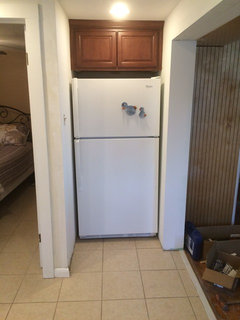
Where is `freezer`? Image resolution: width=240 pixels, height=320 pixels. freezer is located at coordinates (108, 120).